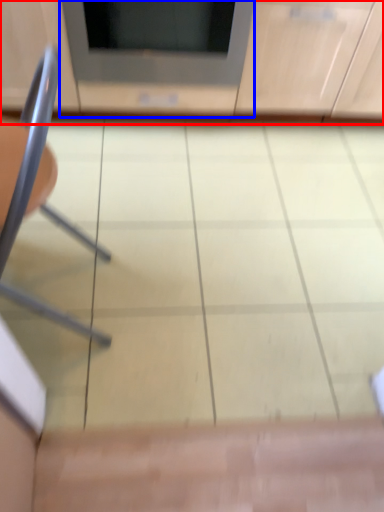
Question: Which of the following is the closest to the observer, cabinetry (highlighted by a red box) or appliance (highlighted by a blue box)?

Choices:
 (A) cabinetry
 (B) appliance

Answer: (A)